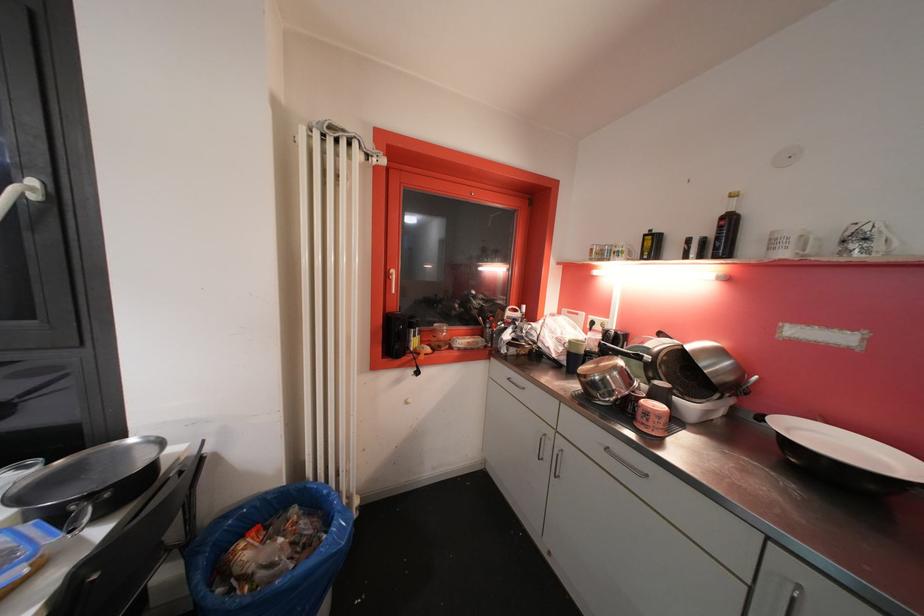
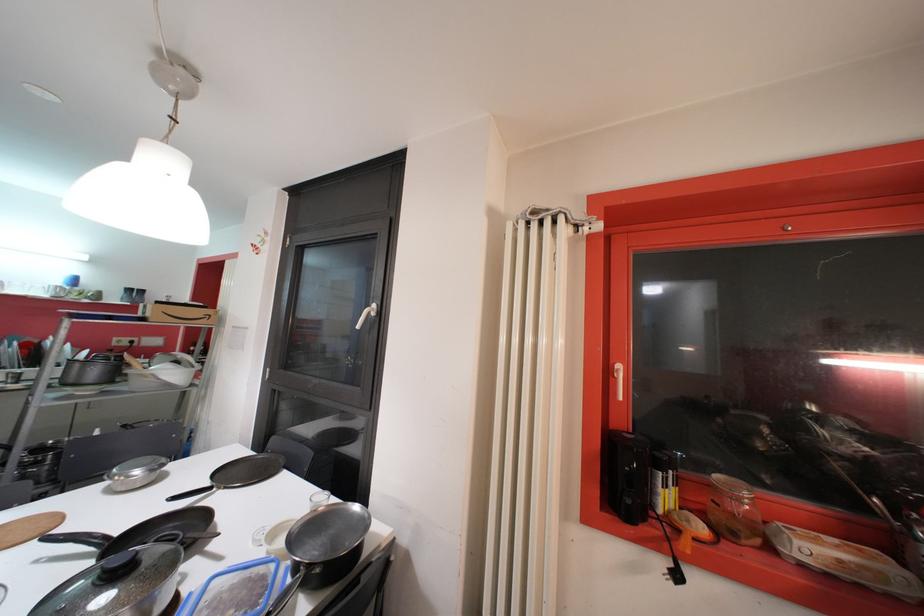
Where in the second image is the point corresponding to point 30,197 from the first image?

(373, 315)